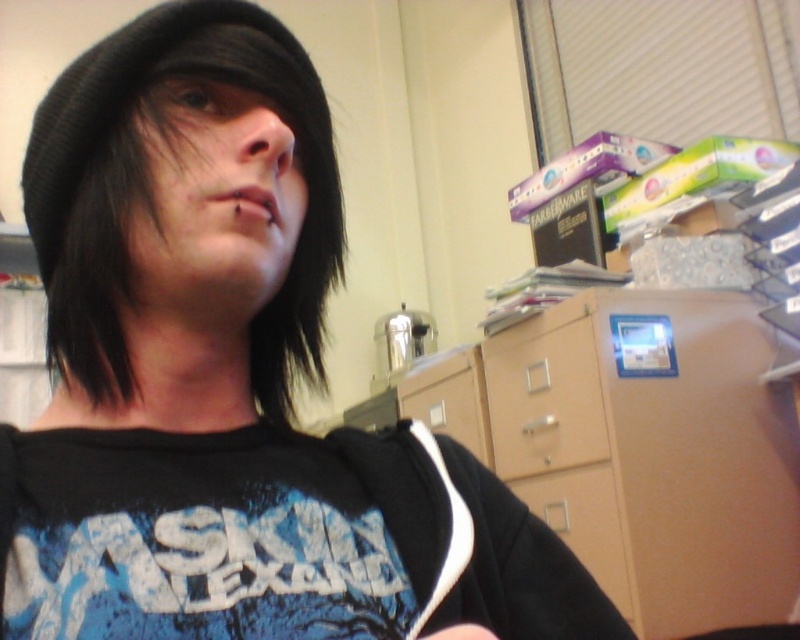
Is beige/file cabinet at lower right bigger than black matte hand at lower left?

Yes, beige/file cabinet at lower right is bigger than black matte hand at lower left.

Who is more distant from viewer, (756, 545) or (452, 628)?

Positioned behind is point (756, 545).

Is point (712, 323) farther from camera compared to point (462, 627)?

Yes.

Where is `beige/file cabinet at lower right`? The image size is (800, 640). beige/file cabinet at lower right is located at coordinates (656, 451).

Is point (306, 221) positioned after point (470, 634)?

Yes, it is behind point (470, 634).

How far apart are black knit hat at upper left and black matte hand at lower left?

black knit hat at upper left is 10.04 inches from black matte hand at lower left.

Describe the element at coordinates (116, 124) in the screenshot. I see `black knit hat at upper left` at that location.

Image resolution: width=800 pixels, height=640 pixels. I want to click on black knit hat at upper left, so click(x=116, y=124).

Between beige/file cabinet at lower right and black knit hat at upper left, which one appears on the left side from the viewer's perspective?

Positioned to the left is black knit hat at upper left.

Does point (744, 611) come farther from viewer compared to point (32, 122)?

That is False.

Is point (509, 448) farther from camera compared to point (102, 381)?

Yes, it is behind point (102, 381).

The image size is (800, 640). What are the coordinates of `beige/file cabinet at lower right` in the screenshot? It's located at (656, 451).